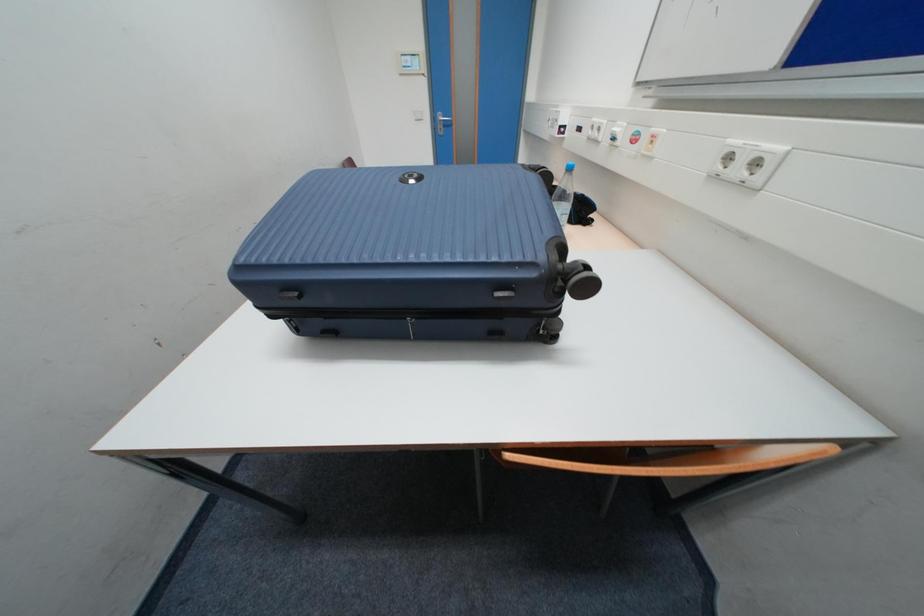
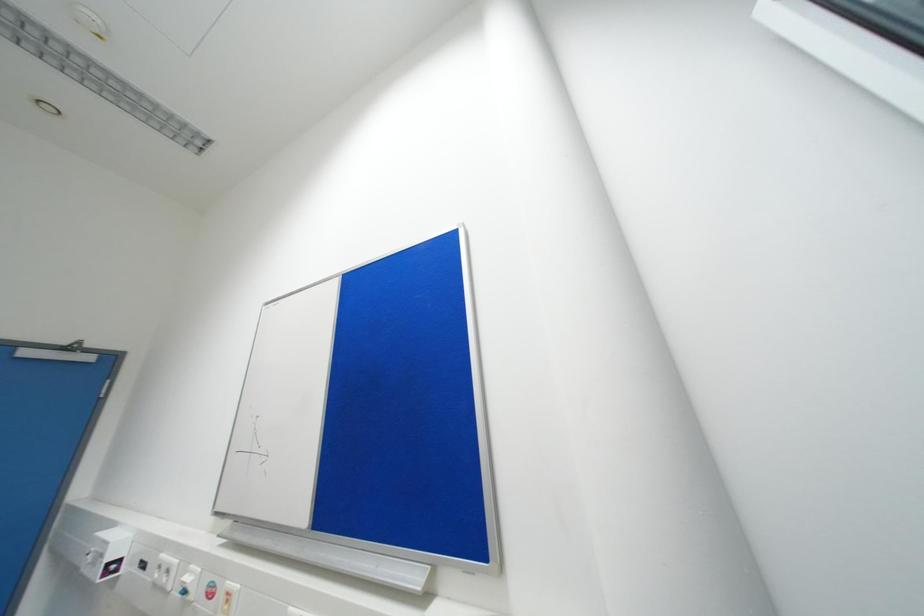
How did the camera likely rotate?

The camera's rotation is toward right-up.